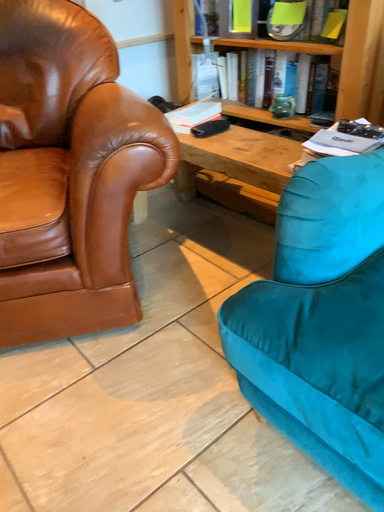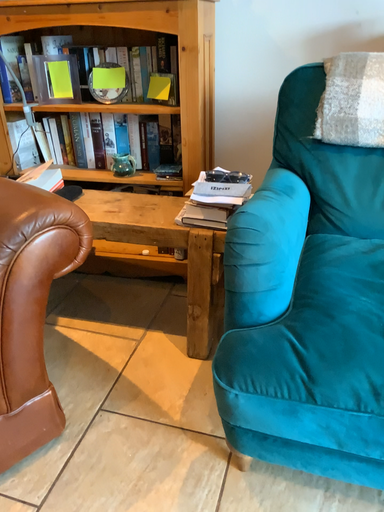
Question: Which way did the camera rotate in the video?

Choices:
 (A) rotated right
 (B) rotated left

Answer: (A)